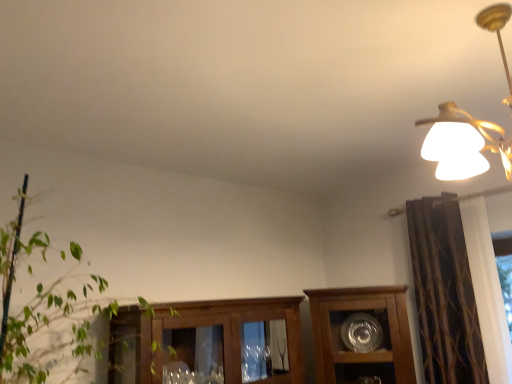
Question: Looking at the image, does wooden cabinet at center seem bigger or smaller compared to green leafy plant at left?

Choices:
 (A) big
 (B) small

Answer: (B)

Question: From a real-world perspective, is wooden cabinet at center physically located above or below green leafy plant at left?

Choices:
 (A) below
 (B) above

Answer: (A)

Question: Based on their relative distances, which object is nearer to the matte gold chandelier at upper right?

Choices:
 (A) wooden cabinet at center
 (B) green leafy plant at left
 (C) brown textured curtain at right

Answer: (C)

Question: Considering the real-world distances, which object is farthest from the wooden cabinet at center?

Choices:
 (A) green leafy plant at left
 (B) matte gold chandelier at upper right
 (C) brown textured curtain at right

Answer: (B)